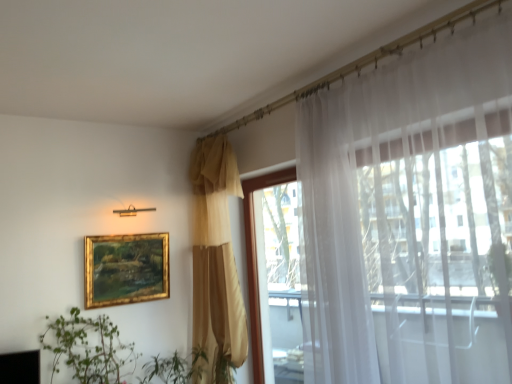
Measure the distance between point [140,293] and camera.

A distance of 3.06 meters exists between point [140,293] and camera.

This screenshot has width=512, height=384. Describe the element at coordinates (126, 269) in the screenshot. I see `gold-framed painting at upper left` at that location.

How much space does white sheer curtain at right, which ranks as the first curtain in right-to-left order, occupy horizontally?

It is 16.44 inches.

Where is `white sheer curtain at right, which ranks as the first curtain in right-to-left order`? white sheer curtain at right, which ranks as the first curtain in right-to-left order is located at coordinates (405, 217).

Image resolution: width=512 pixels, height=384 pixels. Find the location of `green leafy plant at lower left`. green leafy plant at lower left is located at coordinates (89, 349).

Is gold-framed painting at upper left wider or thinner than matte gold curtain at center, which is the 2th curtain from front to back?

gold-framed painting at upper left is thinner than matte gold curtain at center, which is the 2th curtain from front to back.

Who is more distant, gold-framed painting at upper left or matte gold curtain at center, marked as the first curtain in a left-to-right arrangement?

gold-framed painting at upper left is further away from the camera.

Would you say matte gold curtain at center, arranged as the second curtain when viewed from the right, is part of gold-framed painting at upper left's contents?

No, matte gold curtain at center, arranged as the second curtain when viewed from the right, is not inside gold-framed painting at upper left.

Is gold-framed painting at upper left at the left side of matte gold curtain at center, which is the 1th curtain in back-to-front order?

Yes.

Which object is more forward, gold-framed painting at upper left or white sheer curtain at right, the 1th curtain from the front?

white sheer curtain at right, the 1th curtain from the front, is closer to the camera.

Choose the correct answer: Is gold-framed painting at upper left inside white sheer curtain at right, which appears as the 2th curtain when viewed from the back, or outside it?

gold-framed painting at upper left is spatially situated outside white sheer curtain at right, which appears as the 2th curtain when viewed from the back.

In the scene shown: Between gold-framed painting at upper left and white sheer curtain at right, which ranks as the first curtain in right-to-left order, which one appears on the right side from the viewer's perspective?

white sheer curtain at right, which ranks as the first curtain in right-to-left order.

Considering the points (148, 268) and (411, 361), which point is behind, point (148, 268) or point (411, 361)?

The point (148, 268) is farther from the camera.

From a real-world perspective, is white sheer curtain at right, the 1th curtain from the front, positioned above or below matte gold curtain at center, marked as the first curtain in a left-to-right arrangement?

Clearly, from a real-world perspective, white sheer curtain at right, the 1th curtain from the front, is above matte gold curtain at center, marked as the first curtain in a left-to-right arrangement.

Is white sheer curtain at right, the 1th curtain from the front, next to matte gold curtain at center, which is the 1th curtain in back-to-front order, and touching it?

No, white sheer curtain at right, the 1th curtain from the front, is not next to matte gold curtain at center, which is the 1th curtain in back-to-front order.

Which object is thinner, white sheer curtain at right, which appears as the 2th curtain when viewed from the back, or matte gold curtain at center, which is the 2th curtain from front to back?

matte gold curtain at center, which is the 2th curtain from front to back.

Can we say white sheer curtain at right, which appears as the 2th curtain when viewed from the back, lies outside matte gold curtain at center, marked as the first curtain in a left-to-right arrangement?

white sheer curtain at right, which appears as the 2th curtain when viewed from the back, is positioned outside matte gold curtain at center, marked as the first curtain in a left-to-right arrangement.

Between matte gold curtain at center, which is the 1th curtain in back-to-front order, and gold-framed painting at upper left, which one appears on the left side from the viewer's perspective?

From the viewer's perspective, gold-framed painting at upper left appears more on the left side.

This screenshot has width=512, height=384. In the image, there is a matte gold curtain at center, marked as the first curtain in a left-to-right arrangement. Identify the location of picture frame below it (from a real-world perspective). (126, 269).

Can you confirm if matte gold curtain at center, which is the 1th curtain in back-to-front order, is wider than gold-framed painting at upper left?

Indeed, matte gold curtain at center, which is the 1th curtain in back-to-front order, has a greater width compared to gold-framed painting at upper left.

From the image's perspective, would you say matte gold curtain at center, which is the 2th curtain from front to back, is shown under gold-framed painting at upper left?

No, from the image's perspective, matte gold curtain at center, which is the 2th curtain from front to back, is not beneath gold-framed painting at upper left.

From the image's perspective, which is below, transparent glass window at upper right or green leafy plant at lower left?

green leafy plant at lower left is shown below in the image.

Between transparent glass window at upper right and green leafy plant at lower left, which one has more height?

Standing taller between the two is transparent glass window at upper right.

Is transparent glass window at upper right facing away from green leafy plant at lower left?

Result: transparent glass window at upper right does not have its back to green leafy plant at lower left.

Is there a large distance between transparent glass window at upper right and green leafy plant at lower left?

Yes.

Is matte gold curtain at center, which is the 1th curtain in back-to-front order, directly adjacent to green leafy plant at lower left?

There is a gap between matte gold curtain at center, which is the 1th curtain in back-to-front order, and green leafy plant at lower left.

Based on the photo, considering the relative sizes of matte gold curtain at center, which is the 1th curtain in back-to-front order, and green leafy plant at lower left in the image provided, is matte gold curtain at center, which is the 1th curtain in back-to-front order, smaller than green leafy plant at lower left?

Actually, matte gold curtain at center, which is the 1th curtain in back-to-front order, might be larger than green leafy plant at lower left.

Is matte gold curtain at center, which is the 2th curtain from front to back, taller than green leafy plant at lower left?

Yes.

Considering the positions of point (208, 232) and point (90, 366), is point (208, 232) closer or farther from the camera than point (90, 366)?

Point (208, 232) is positioned farther from the camera compared to point (90, 366).

Find the location of `houseplant in front of the matte gold curtain at center, marked as the first curtain in a left-to-right arrangement`. houseplant in front of the matte gold curtain at center, marked as the first curtain in a left-to-right arrangement is located at coordinates (89, 349).

Which is closer to the camera, (106, 338) or (206, 381)?

Point (106, 338).

In order to click on picture frame below the matte gold curtain at center, marked as the first curtain in a left-to-right arrangement (from a real-world perspective) in this screenshot , I will do `click(126, 269)`.

The height and width of the screenshot is (384, 512). There is a gold-framed painting at upper left. What are the coordinates of `the 2nd curtain above it (from a real-world perspective)` in the screenshot? It's located at (405, 217).

Which object lies further to the anchor point green leafy plant at lower left, matte gold curtain at center, marked as the first curtain in a left-to-right arrangement, or transparent glass window at upper right?

transparent glass window at upper right is further to green leafy plant at lower left.

From the image, which object appears to be nearer to matte gold curtain at center, arranged as the second curtain when viewed from the right, green leafy plant at lower left or gold-framed painting at upper left?

gold-framed painting at upper left is closer to matte gold curtain at center, arranged as the second curtain when viewed from the right.

Looking at the image, which one is located further to matte gold curtain at center, which is the 1th curtain in back-to-front order, transparent glass window at upper right or green leafy plant at lower left?

green leafy plant at lower left is positioned further to the anchor matte gold curtain at center, which is the 1th curtain in back-to-front order.

From the image, which object appears to be farther from matte gold curtain at center, arranged as the second curtain when viewed from the right, transparent glass window at upper right or white sheer curtain at right, the 1th curtain from the front?

The object further to matte gold curtain at center, arranged as the second curtain when viewed from the right, is white sheer curtain at right, the 1th curtain from the front.

Estimate the real-world distances between objects in this image. Which object is closer to green leafy plant at lower left, transparent glass window at upper right or gold-framed painting at upper left?

Among the two, gold-framed painting at upper left is located nearer to green leafy plant at lower left.

When comparing their distances from green leafy plant at lower left, does transparent glass window at upper right or white sheer curtain at right, the 2th curtain positioned from the left, seem closer?

transparent glass window at upper right.

From the picture: When comparing their distances from white sheer curtain at right, which appears as the 2th curtain when viewed from the back, does green leafy plant at lower left or gold-framed painting at upper left seem further?

Among the two, green leafy plant at lower left is located further to white sheer curtain at right, which appears as the 2th curtain when viewed from the back.

Estimate the real-world distances between objects in this image. Which object is closer to transparent glass window at upper right, gold-framed painting at upper left or green leafy plant at lower left?

The object closer to transparent glass window at upper right is gold-framed painting at upper left.

Where is `curtain between white sheer curtain at right, which appears as the 2th curtain when viewed from the back, and gold-framed painting at upper left in the front-back direction`? This screenshot has height=384, width=512. curtain between white sheer curtain at right, which appears as the 2th curtain when viewed from the back, and gold-framed painting at upper left in the front-back direction is located at coordinates (216, 260).

You are a GUI agent. You are given a task and a screenshot of the screen. Output one action in this format:
    pyautogui.click(x=<x>, y=<y>)
    Task: Click on the curtain between green leafy plant at lower left and transparent glass window at upper right in the horizontal direction
    The image size is (512, 384).
    Given the screenshot: What is the action you would take?
    pyautogui.click(x=216, y=260)

Find the location of `curtain between green leafy plant at lower left and white sheer curtain at right, the 2th curtain positioned from the left`. curtain between green leafy plant at lower left and white sheer curtain at right, the 2th curtain positioned from the left is located at coordinates (216, 260).

What are the coordinates of `picture frame between green leafy plant at lower left and matte gold curtain at center, which is the 2th curtain from front to back, from left to right` in the screenshot? It's located at (126, 269).